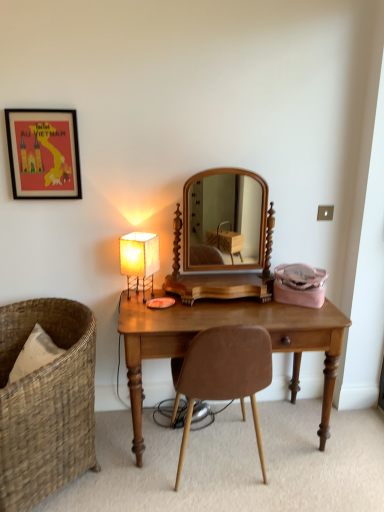
The image size is (384, 512). I want to click on vacant space underneath wooden desk at center (from a real-world perspective), so click(x=248, y=429).